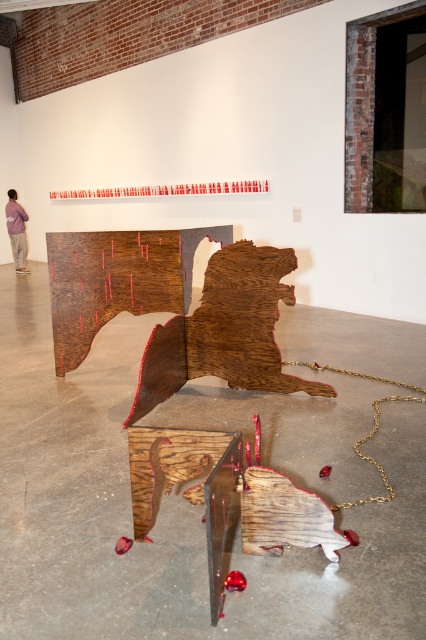
You are an art curator standing in front of the wooden carving at center and the purple cotton shirt at upper left. Which object is nearer to you?

The wooden carving at center is closer to the viewer than the purple cotton shirt at upper left.